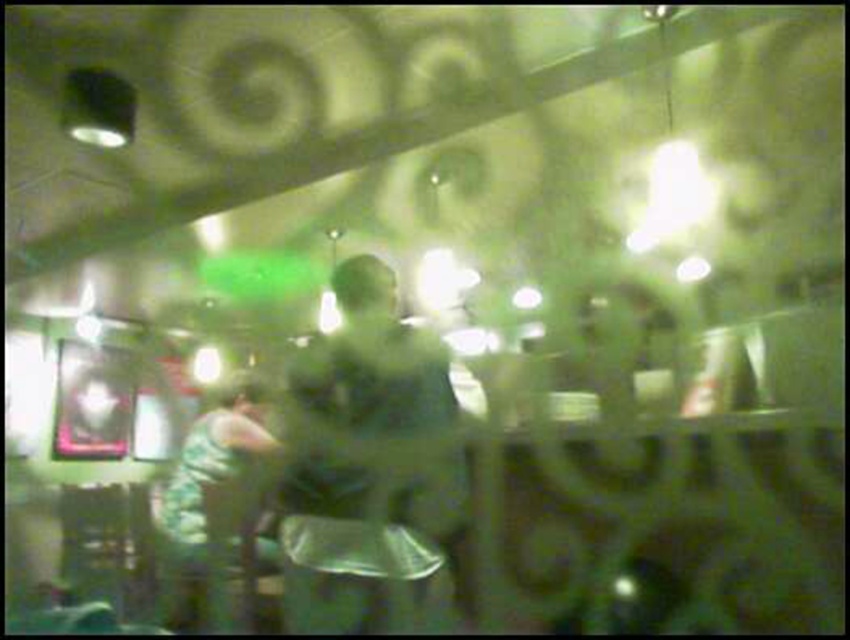
In the scene shown: Is green matte shirt at center to the right of green camouflage jacket at left from the viewer's perspective?

Yes, green matte shirt at center is to the right of green camouflage jacket at left.

Who is positioned more to the right, green matte shirt at center or green camouflage jacket at left?

Positioned to the right is green matte shirt at center.

Is point (313, 580) closer to viewer compared to point (188, 516)?

Yes, point (313, 580) is in front of point (188, 516).

This screenshot has height=640, width=850. What are the coordinates of `green matte shirt at center` in the screenshot? It's located at (366, 458).